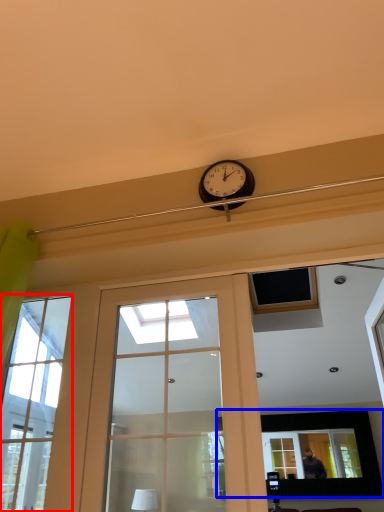
Question: Which object appears farthest to the camera in this image, window (highlighted by a red box) or picture frame (highlighted by a blue box)?

Choices:
 (A) window
 (B) picture frame

Answer: (B)